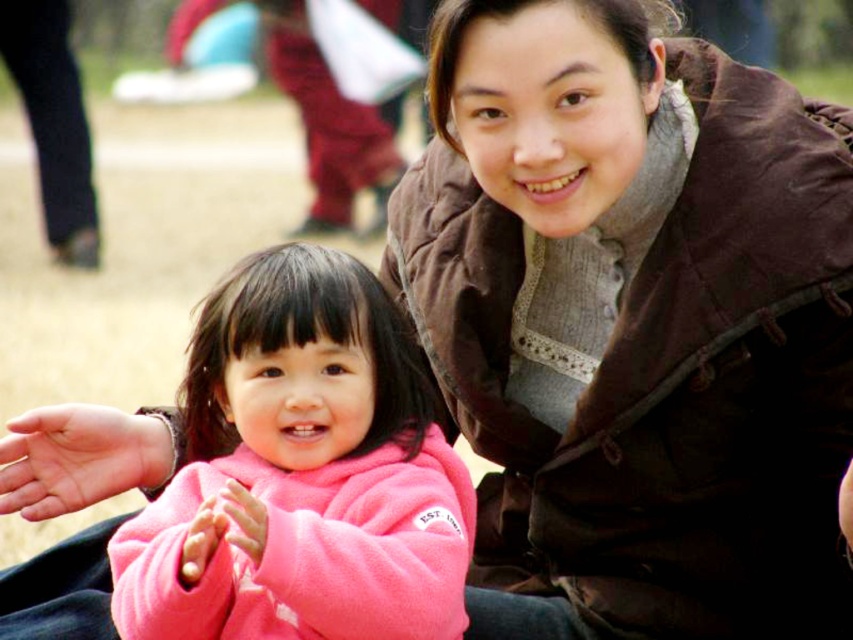
Between brown velvety jacket at center and smooth brown leather hand at center, which one is positioned lower?

smooth brown leather hand at center

Between brown velvety jacket at center and smooth brown leather hand at center, which one appears on the right side from the viewer's perspective?

brown velvety jacket at center is more to the right.

This screenshot has width=853, height=640. What do you see at coordinates (634, 323) in the screenshot?
I see `brown velvety jacket at center` at bounding box center [634, 323].

Identify the location of brown velvety jacket at center. Image resolution: width=853 pixels, height=640 pixels. (634, 323).

Is brown velvety jacket at center closer to camera compared to pink fleece jacket at center?

No, it is behind pink fleece jacket at center.

Who is positioned more to the right, brown velvety jacket at center or pink fleece jacket at center?

From the viewer's perspective, brown velvety jacket at center appears more on the right side.

Who is more forward, (x=757, y=625) or (x=224, y=310)?

Point (x=224, y=310) is more forward.

Find the location of a particular element. brown velvety jacket at center is located at coordinates 634,323.

Based on the photo, does pink fleece jacket at center come in front of smooth brown leather hand at center?

That is True.

Does point (273, 365) come closer to viewer compared to point (115, 410)?

That is True.

The width and height of the screenshot is (853, 640). I want to click on pink fleece jacket at center, so click(303, 472).